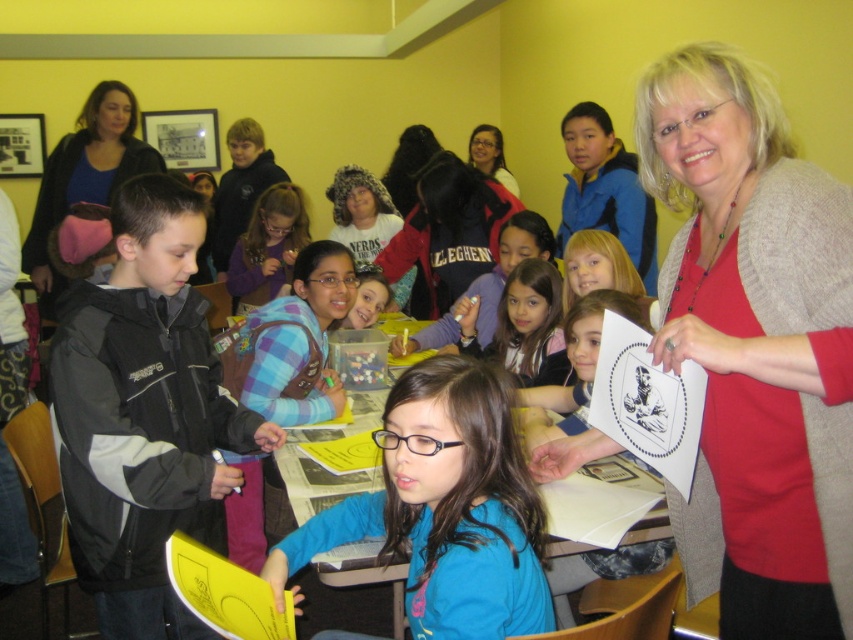
Question: Can you confirm if black jacket at left is positioned above matte black jacket at center?

Choices:
 (A) yes
 (B) no

Answer: (B)

Question: Which object appears farthest from the camera in this image?

Choices:
 (A) matte black glasses at center
 (B) black jacket at left
 (C) red sweater at upper right
 (D) matte black jacket at center

Answer: (A)

Question: Is matte black jacket at center positioned at the back of blue jersey at upper left?

Choices:
 (A) no
 (B) yes

Answer: (A)

Question: Observing the image, what is the correct spatial positioning of red sweater at upper right in reference to matte blue shirt at center?

Choices:
 (A) above
 (B) below

Answer: (B)

Question: Which point is closer to the camera taking this photo?

Choices:
 (A) (199, 484)
 (B) (515, 192)
 (C) (428, 189)
 (D) (51, 276)

Answer: (A)

Question: Considering the real-world distances, which object is farthest from the red sweater at upper right?

Choices:
 (A) matte blue shirt at center
 (B) matte black jacket at center
 (C) blue jersey at upper left
 (D) black jacket at left

Answer: (C)